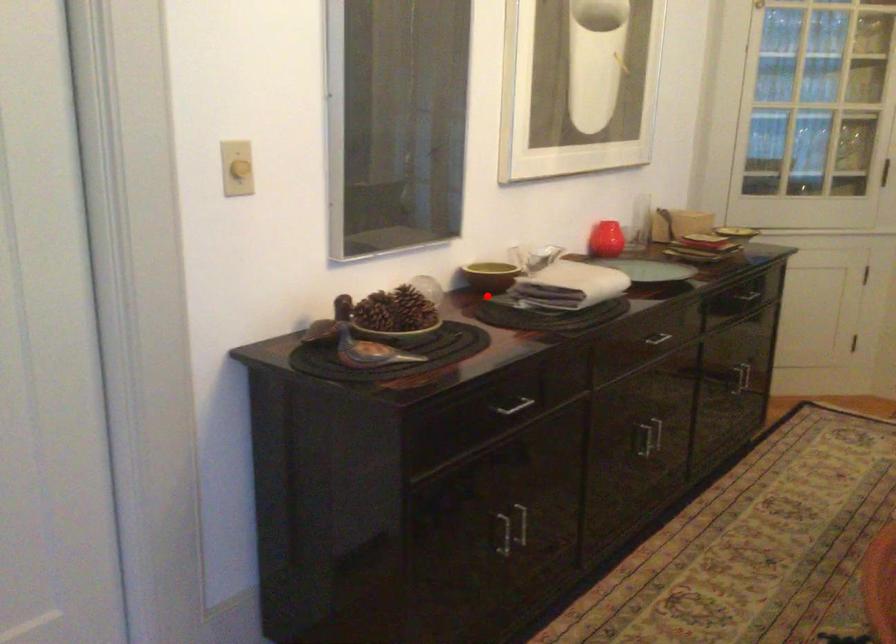
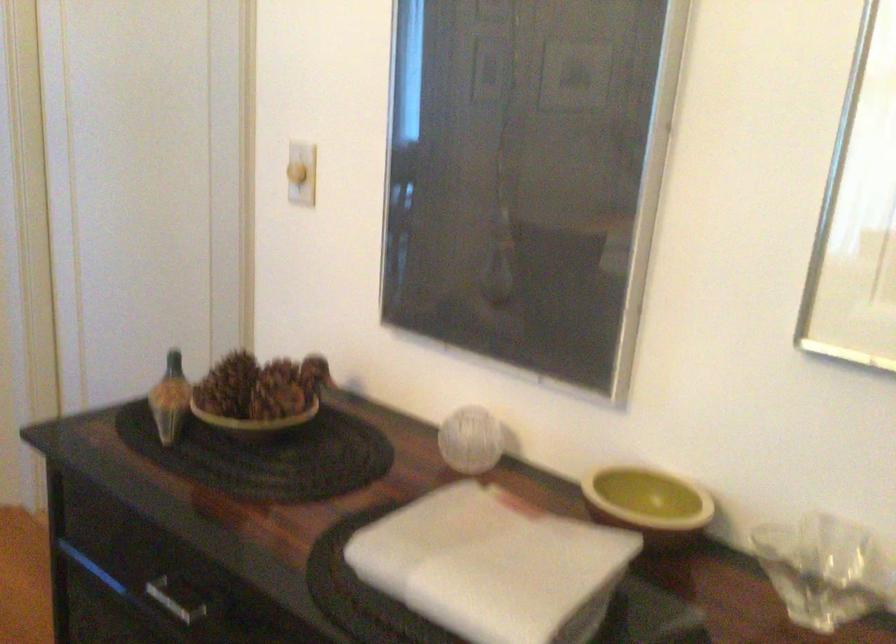
In the second image, find the point that corresponds to the highlighted location in the first image.

(648, 503)